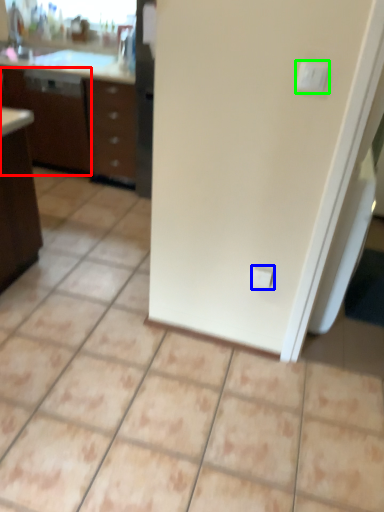
Question: Which object is the closest to the file cabinet (highlighted by a red box)? Choose among these: electric outlet (highlighted by a blue box) or light switch (highlighted by a green box).

Choices:
 (A) electric outlet
 (B) light switch

Answer: (A)